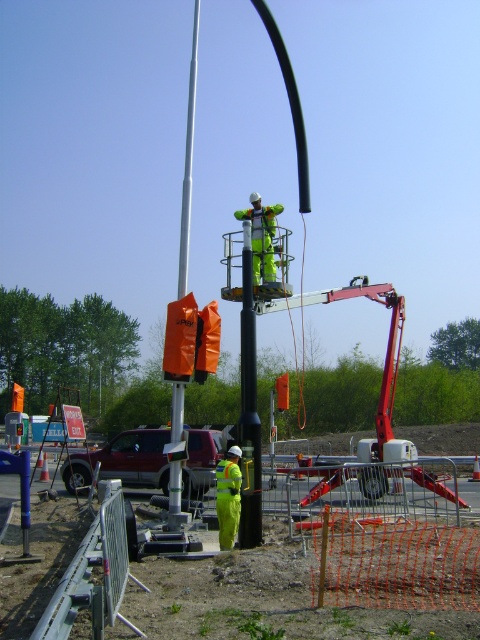
You are a worker on the ground and need to locate the black rubber pole at center. According to the coordinates provided, where should you look?

The black rubber pole at center is located at point (249,408).

You are a safety inspector reviewing this construction site. You notice two points marked on the image at coordinates point [241,387] and point [252,216]. According to the safety guidelines, workers must maintain a minimum distance of 1 meter from any point closer to the camera than another. Which point should the worker avoid standing near to comply with the safety rule?

Point [241,387] is closer to the camera than point [252,216]. Therefore, the worker should avoid standing near point [241,387] to maintain the required 1 meter distance from the closer point.